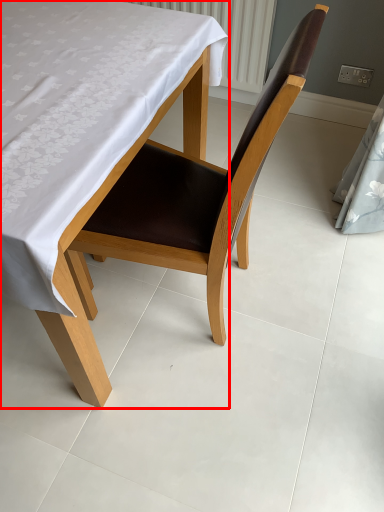
Question: From the image's perspective, what is the correct spatial relationship of table (annotated by the red box) in relation to chair?

Choices:
 (A) below
 (B) above

Answer: (B)